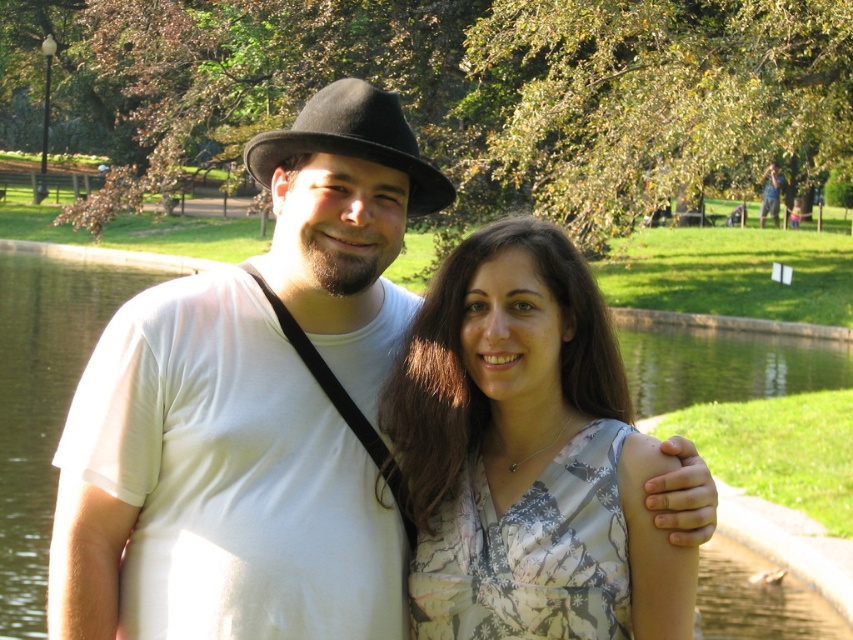
You are a GUI agent. You are given a task and a screenshot of the screen. Output one action in this format:
    pyautogui.click(x=<x>, y=<y>)
    Task: Click on the white matte shirt at center
    
    Given the screenshot: What is the action you would take?
    pyautogui.click(x=251, y=413)

Is white matte shirt at center to the right of floral print blouse at center from the viewer's perspective?

Incorrect, white matte shirt at center is not on the right side of floral print blouse at center.

Which is behind, point (184, 364) or point (416, 561)?

Point (416, 561)

The height and width of the screenshot is (640, 853). Identify the location of white matte shirt at center. (251, 413).

Is floral print blouse at center smaller than black felt fedora at center?

Actually, floral print blouse at center might be larger than black felt fedora at center.

Can you confirm if floral print blouse at center is positioned below black felt fedora at center?

Yes, floral print blouse at center is below black felt fedora at center.

What do you see at coordinates (526, 454) in the screenshot?
I see `floral print blouse at center` at bounding box center [526, 454].

You are a GUI agent. You are given a task and a screenshot of the screen. Output one action in this format:
    pyautogui.click(x=<x>, y=<y>)
    Task: Click on the floral print blouse at center
    This screenshot has width=853, height=640.
    Given the screenshot: What is the action you would take?
    pyautogui.click(x=526, y=454)

This screenshot has width=853, height=640. Describe the element at coordinates (251, 413) in the screenshot. I see `white matte shirt at center` at that location.

Does point (228, 529) lie behind point (351, 104)?

That is False.

Identify the location of white matte shirt at center. The image size is (853, 640). (251, 413).